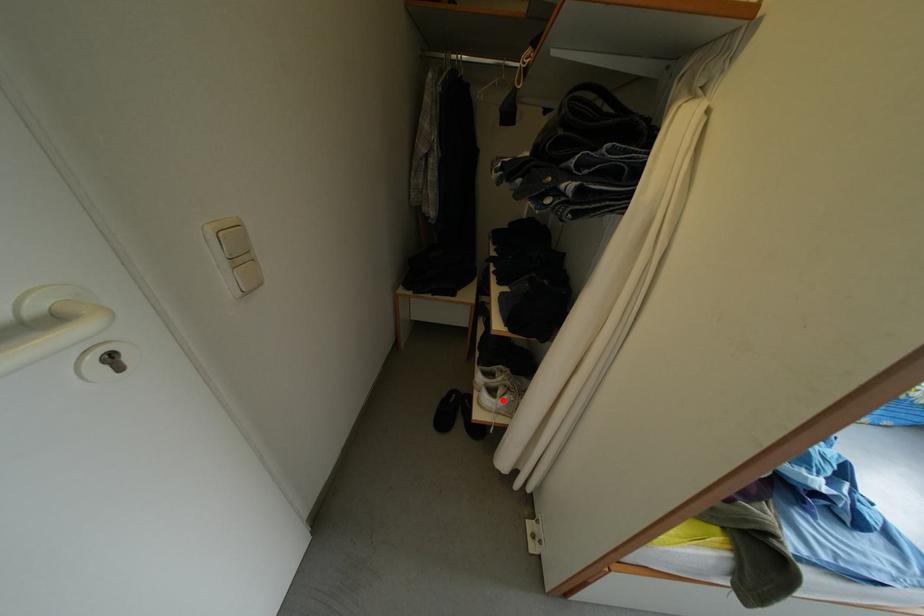
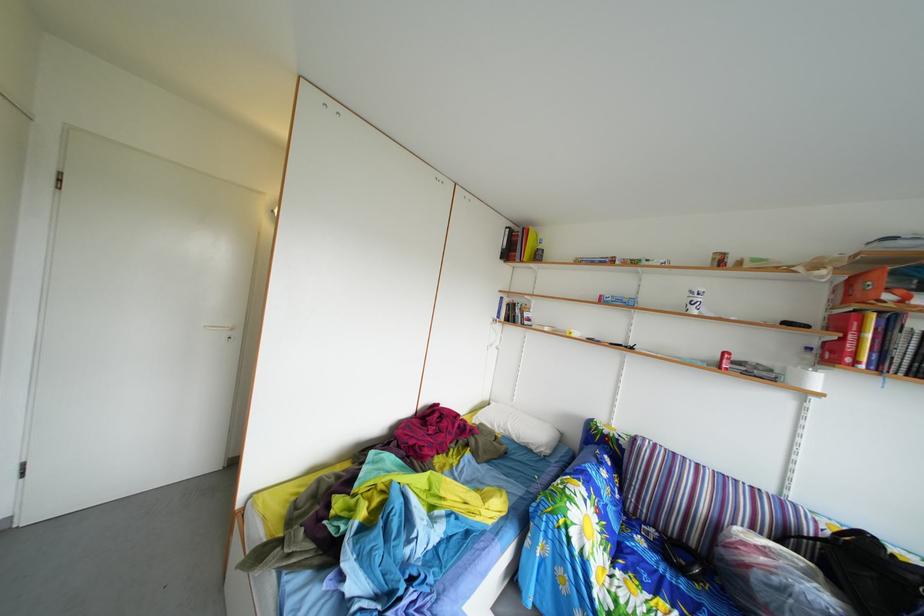
Question: I am providing you with two images of the same scene from different viewpoints. A red point is marked on the first image. Can you still see the location of the red point in image 2?

Choices:
 (A) Yes
 (B) No

Answer: (B)